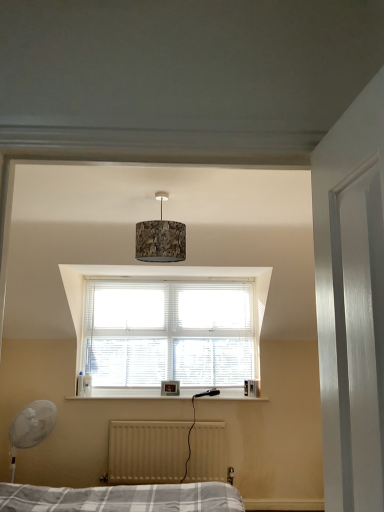
What do you see at coordinates (147, 451) in the screenshot? This screenshot has height=512, width=384. I see `white matte radiator at lower center` at bounding box center [147, 451].

This screenshot has height=512, width=384. Describe the element at coordinates (31, 426) in the screenshot. I see `white plastic fan at lower left` at that location.

What is the approximate height of white plastic fan at lower left?

91.49 centimeters.

Measure the distance between point [168,223] and camera.

A distance of 2.29 meters exists between point [168,223] and camera.

Where is `white matte radiator at lower center`? The height and width of the screenshot is (512, 384). white matte radiator at lower center is located at coordinates (147, 451).

Does textured cork lampshade at center have a lesser height compared to white plastic fan at lower left?

Yes.

Can you confirm if textured cork lampshade at center is wider than white plastic fan at lower left?

Yes.

Measure the distance between textured cork lampshade at center and white plastic fan at lower left.

The distance of textured cork lampshade at center from white plastic fan at lower left is 6.91 feet.

Does point (175, 255) come behind point (14, 424)?

No, (175, 255) is closer to viewer.

Which is closer, (34, 426) or (142, 452)?

Point (34, 426) appears to be closer to the viewer than point (142, 452).

Consider the image. How different are the orientations of white plastic fan at lower left and white matte radiator at lower center in degrees?

The facing directions of white plastic fan at lower left and white matte radiator at lower center are 43.7 degrees apart.

Is white plastic fan at lower left positioned beyond the bounds of white matte radiator at lower center?

white plastic fan at lower left lies outside white matte radiator at lower center's area.

Is white matte radiator at lower center far away from white plastic fan at lower left?

No, white matte radiator at lower center is not far away from white plastic fan at lower left.

From a real-world perspective, is white matte radiator at lower center positioned above or below white plastic fan at lower left?

In terms of real-world spatial position, white matte radiator at lower center is below white plastic fan at lower left.

Relative to white plastic fan at lower left, is white matte radiator at lower center in front or behind?

In the image, white matte radiator at lower center appears behind white plastic fan at lower left.

Which point is more forward, (125, 453) or (47, 410)?

Point (47, 410)

Is white matte radiator at lower center situated inside textured cork lampshade at center or outside?

white matte radiator at lower center is not enclosed by textured cork lampshade at center.

From the image's perspective, which is below, white matte radiator at lower center or textured cork lampshade at center?

white matte radiator at lower center appears lower in the image.

Considering the sizes of objects white matte radiator at lower center and textured cork lampshade at center in the image provided, who is taller, white matte radiator at lower center or textured cork lampshade at center?

white matte radiator at lower center is taller.

Would you say textured cork lampshade at center is to the left or to the right of white matte radiator at lower center in the picture?

textured cork lampshade at center is positioned on white matte radiator at lower center's right side.

From a real-world perspective, is textured cork lampshade at center over white matte radiator at lower center?

Indeed, from a real-world perspective, textured cork lampshade at center stands above white matte radiator at lower center.

Between textured cork lampshade at center and white matte radiator at lower center, which one has less height?

Standing shorter between the two is textured cork lampshade at center.

From the image's perspective, which one is positioned lower, white plastic fan at lower left or textured cork lampshade at center?

white plastic fan at lower left is shown below in the image.

Does white plastic fan at lower left come behind textured cork lampshade at center?

Yes, white plastic fan at lower left is behind textured cork lampshade at center.

Considering the sizes of white plastic fan at lower left and textured cork lampshade at center in the image, is white plastic fan at lower left bigger or smaller than textured cork lampshade at center?

In the image, white plastic fan at lower left appears to be larger than textured cork lampshade at center.

Which of these two, white plastic fan at lower left or textured cork lampshade at center, is thinner?

Thinner between the two is white plastic fan at lower left.

Where is `lamp on the right of the white plastic fan at lower left`? Image resolution: width=384 pixels, height=512 pixels. lamp on the right of the white plastic fan at lower left is located at coordinates (160, 239).

Locate an element on the screen. The width and height of the screenshot is (384, 512). table lamp in front of the white matte radiator at lower center is located at coordinates (31, 426).

Looking at the image, which one is located closer to white matte radiator at lower center, white plastic fan at lower left or textured cork lampshade at center?

Among the two, white plastic fan at lower left is located nearer to white matte radiator at lower center.

When comparing their distances from white plastic fan at lower left, does textured cork lampshade at center or white matte radiator at lower center seem further?

textured cork lampshade at center.

Looking at the image, which one is located closer to white plastic fan at lower left, white matte radiator at lower center or textured cork lampshade at center?

white matte radiator at lower center is closer to white plastic fan at lower left.

Estimate the real-world distances between objects in this image. Which object is further from textured cork lampshade at center, white matte radiator at lower center or white plastic fan at lower left?

A: Among the two, white matte radiator at lower center is located further to textured cork lampshade at center.

From the image, which object appears to be nearer to textured cork lampshade at center, white plastic fan at lower left or white matte radiator at lower center?

The object closer to textured cork lampshade at center is white plastic fan at lower left.

When comparing their distances from white matte radiator at lower center, does textured cork lampshade at center or white plastic fan at lower left seem further?

textured cork lampshade at center lies further to white matte radiator at lower center than the other object.

At what (x,y) coordinates should I click in order to perform the action: click on table lamp between textured cork lampshade at center and white matte radiator at lower center vertically. Please return your answer as a coordinate pair (x, y). The height and width of the screenshot is (512, 384). Looking at the image, I should click on (31, 426).